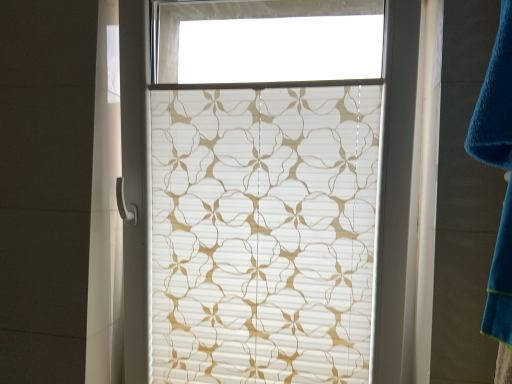
Question: Can you confirm if translucent beige floral-patterned window blind at center is bigger than blue soft towel at right?

Choices:
 (A) yes
 (B) no

Answer: (A)

Question: Can you confirm if translucent beige floral-patterned window blind at center is wider than blue soft towel at right?

Choices:
 (A) yes
 (B) no

Answer: (A)

Question: Can you confirm if translucent beige floral-patterned window blind at center is shorter than blue soft towel at right?

Choices:
 (A) yes
 (B) no

Answer: (B)

Question: Is translucent beige floral-patterned window blind at center at the left side of blue soft towel at right?

Choices:
 (A) yes
 (B) no

Answer: (A)

Question: Is translucent beige floral-patterned window blind at center outside of blue soft towel at right?

Choices:
 (A) no
 (B) yes

Answer: (B)

Question: Is translucent beige floral-patterned window blind at center thinner than blue soft towel at right?

Choices:
 (A) yes
 (B) no

Answer: (B)

Question: Does blue soft towel at right come in front of translucent beige floral-patterned window blind at center?

Choices:
 (A) yes
 (B) no

Answer: (A)

Question: Can you confirm if blue soft towel at right is thinner than translucent beige floral-patterned window blind at center?

Choices:
 (A) no
 (B) yes

Answer: (B)

Question: Would you say blue soft towel at right is a long distance from translucent beige floral-patterned window blind at center?

Choices:
 (A) yes
 (B) no

Answer: (B)

Question: From the image's perspective, would you say blue soft towel at right is positioned over translucent beige floral-patterned window blind at center?

Choices:
 (A) no
 (B) yes

Answer: (B)

Question: Is blue soft towel at right at the right side of translucent beige floral-patterned window blind at center?

Choices:
 (A) yes
 (B) no

Answer: (A)

Question: Does blue soft towel at right have a lesser height compared to translucent beige floral-patterned window blind at center?

Choices:
 (A) no
 (B) yes

Answer: (B)

Question: Is translucent beige floral-patterned window blind at center to the left or to the right of blue soft towel at right in the image?

Choices:
 (A) right
 (B) left

Answer: (B)